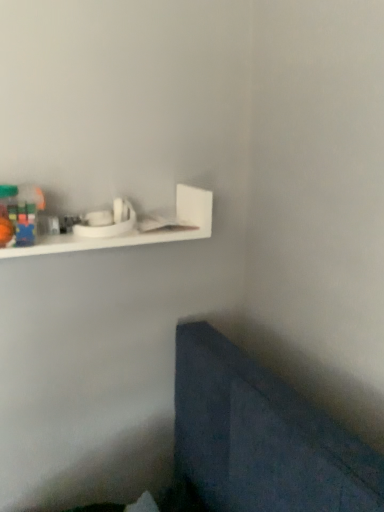
Question: Based on their sizes in the image, would you say rubberized plastic blocks at upper left is bigger or smaller than white matte shelf at upper left?

Choices:
 (A) big
 (B) small

Answer: (B)

Question: Is point (8, 234) closer or farther from the camera than point (23, 252)?

Choices:
 (A) farther
 (B) closer

Answer: (B)

Question: From a real-world perspective, relative to white matte shelf at upper left, is rubberized plastic blocks at upper left vertically above or below?

Choices:
 (A) above
 (B) below

Answer: (A)

Question: Is white matte shelf at upper left taller or shorter than rubberized plastic blocks at upper left?

Choices:
 (A) short
 (B) tall

Answer: (B)

Question: From a real-world perspective, is white matte shelf at upper left positioned above or below rubberized plastic blocks at upper left?

Choices:
 (A) above
 (B) below

Answer: (B)

Question: From the image's perspective, is white matte shelf at upper left above or below rubberized plastic blocks at upper left?

Choices:
 (A) above
 (B) below

Answer: (A)

Question: Considering the positions of point (74, 236) and point (11, 225), is point (74, 236) closer or farther from the camera than point (11, 225)?

Choices:
 (A) closer
 (B) farther

Answer: (B)